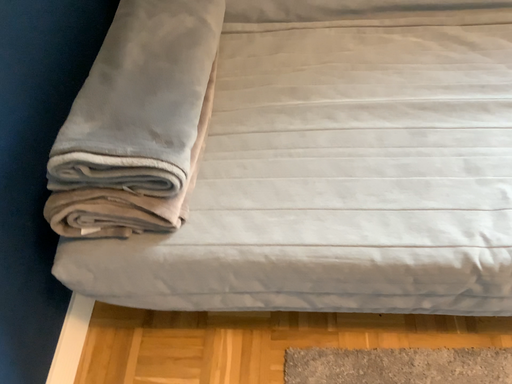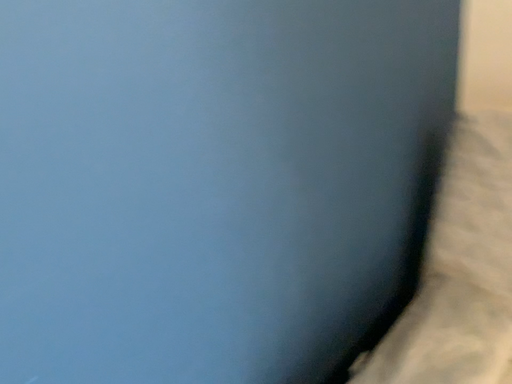
Question: How did the camera likely rotate when shooting the video?

Choices:
 (A) rotated upward
 (B) rotated downward

Answer: (A)